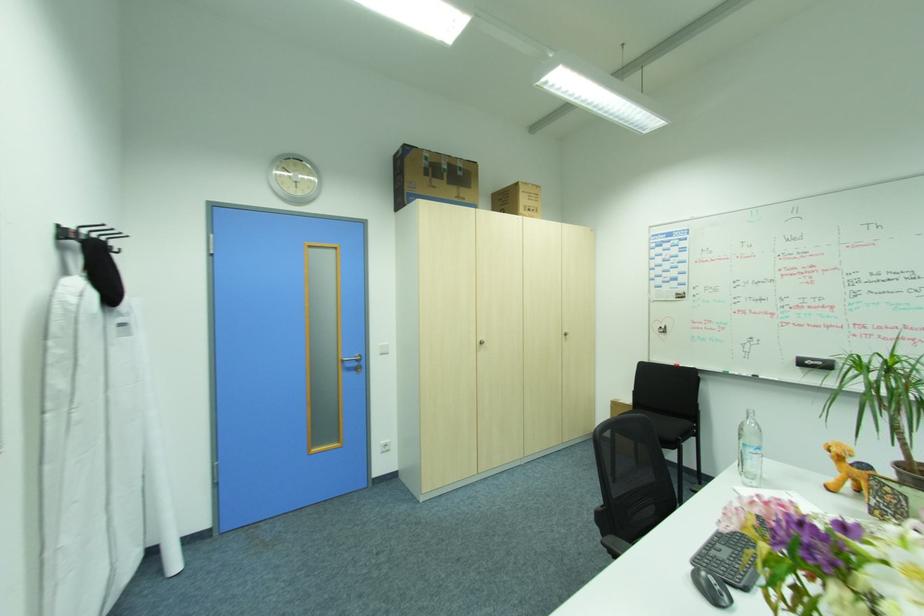
Where would you push the silver door handle? Please return your answer as a coordinate pair (x, y).

(353, 363)